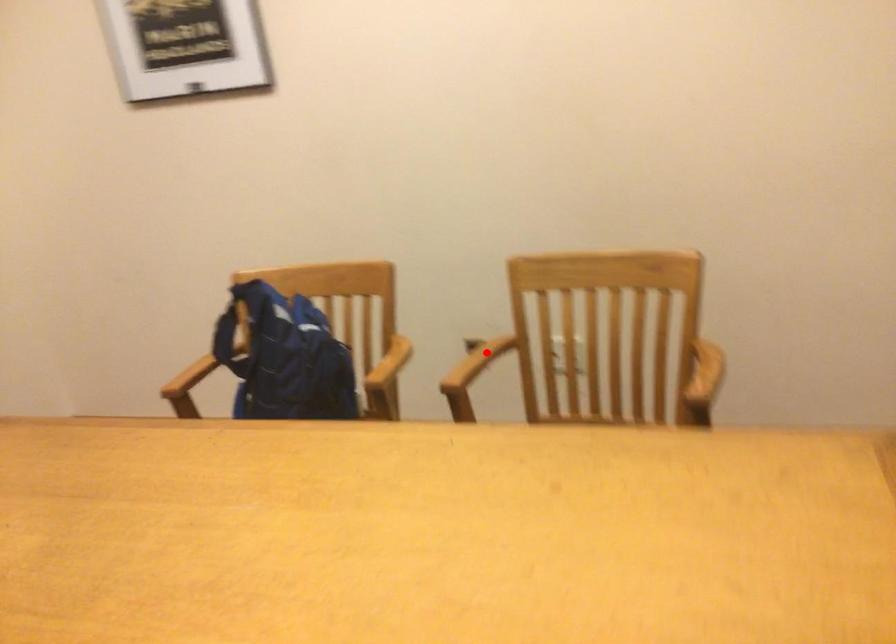
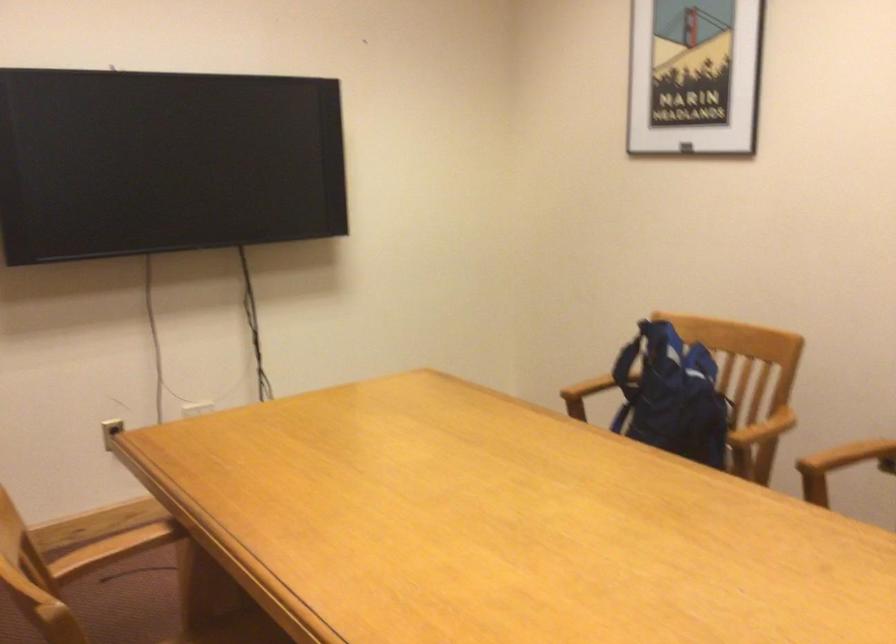
Where in the second image is the point corresponding to the highlighted location from the first image?

(849, 456)